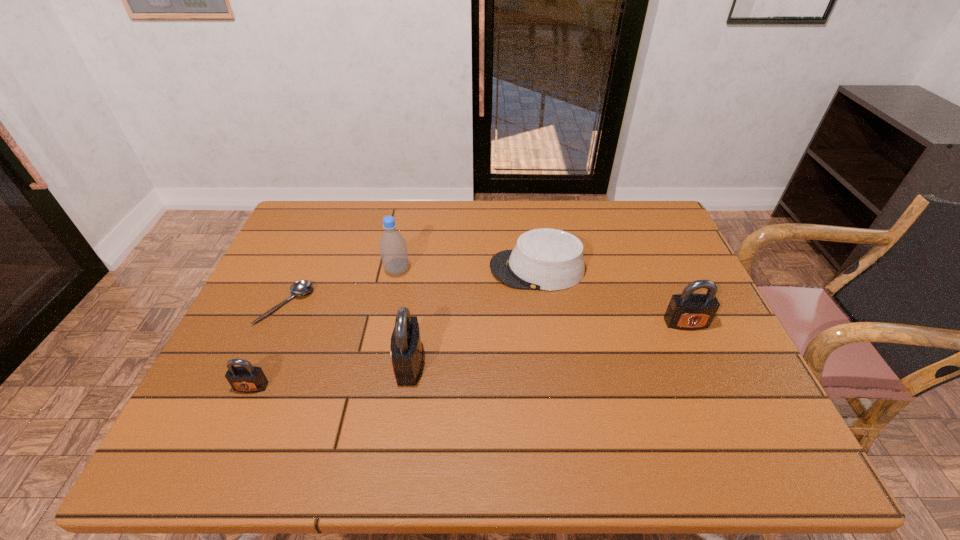
At what (x,y) coordinates should I click in order to perform the action: click on free region at the far edge of the desktop. Please return your answer as a coordinate pair (x, y). The image size is (960, 540). Looking at the image, I should click on (539, 204).

Locate an element on the screen. vacant space at the near edge is located at coordinates (547, 415).

This screenshot has height=540, width=960. I want to click on vacant region at the left edge of the desktop, so click(x=291, y=255).

The height and width of the screenshot is (540, 960). Find the location of `free space at the right edge`. free space at the right edge is located at coordinates (686, 349).

The height and width of the screenshot is (540, 960). I want to click on vacant space at the far left corner of the desktop, so click(314, 242).

Identify the location of free space at the far right corner of the desktop. The image size is (960, 540). (626, 206).

The image size is (960, 540). Identify the location of free point between the rightmost object and the second padlock from left to right. (547, 343).

Locate an element on the screen. The height and width of the screenshot is (540, 960). vacant area between the third object from right to left and the second shortest padlock is located at coordinates (547, 343).

This screenshot has width=960, height=540. I want to click on blank region between the hat and the fourth object from left to right, so click(473, 316).

Find the location of a particular element. The image size is (960, 540). vacant space that is in between the shortest padlock and the farthest padlock is located at coordinates (468, 355).